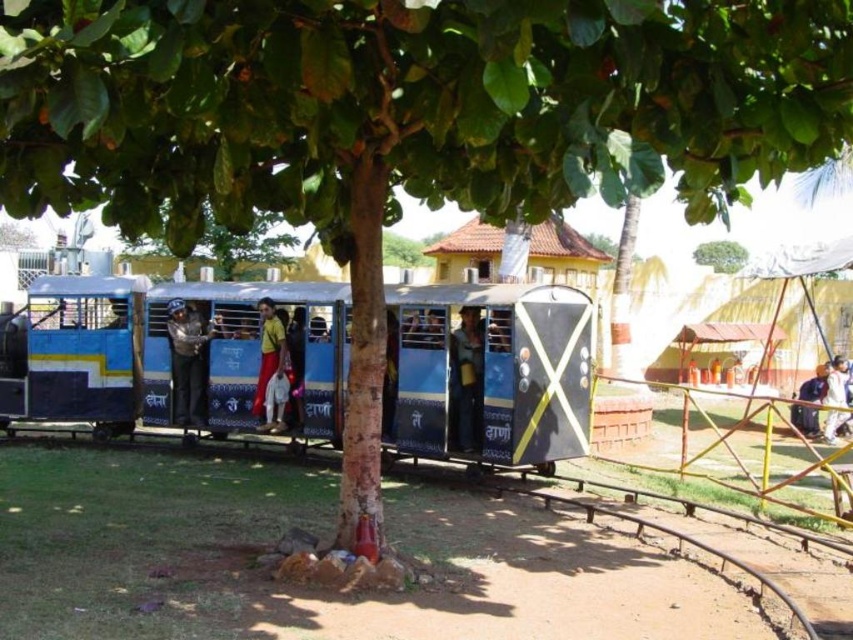
You are a passenger waiting at the train station and see the blue painted metal train at center and the white fabric at right. Which object is closer to you?

The blue painted metal train at center is closer to you because it is in front of the white fabric at right.

What are the coordinates of the blue painted metal train at center?

The coordinates of the blue painted metal train at center are at point (x=173, y=353).

Based on the photo, what are the coordinates of the blue painted metal train at center?

The coordinates of the blue painted metal train at center are at point [173,353].